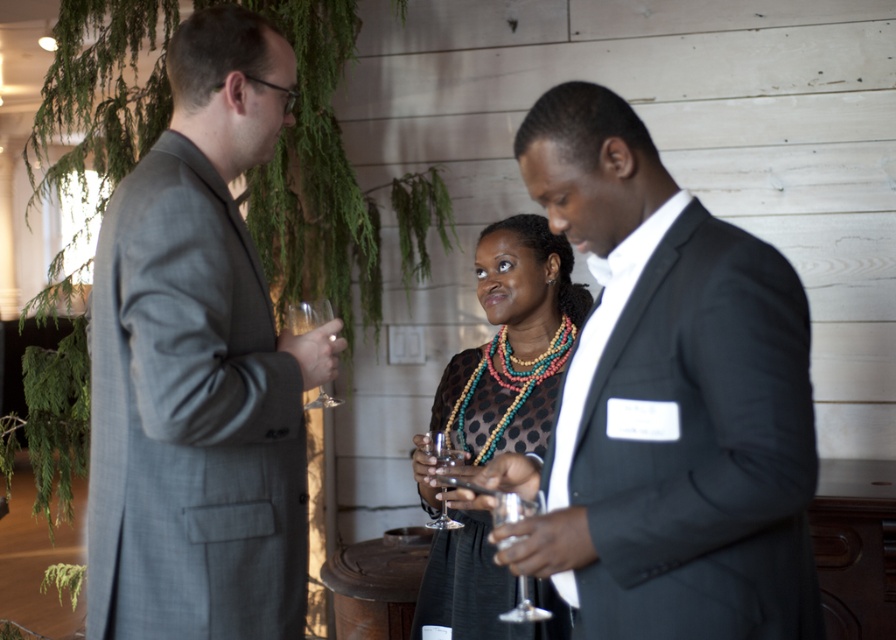
Question: Does clear glass wine glass at lower center lie behind clear glass wine glass at center?

Choices:
 (A) yes
 (B) no

Answer: (B)

Question: Which point is closer to the camera?

Choices:
 (A) (231, 380)
 (B) (477, 374)
 (C) (323, 310)

Answer: (A)

Question: Is black dotted dress at center positioned before clear glass wine glass at lower center?

Choices:
 (A) yes
 (B) no

Answer: (B)

Question: Is matte black suit at center further to the viewer compared to clear glass wine glass at center?

Choices:
 (A) no
 (B) yes

Answer: (A)

Question: Estimate the real-world distances between objects in this image. Which object is farther from the clear glass wine glass at center?

Choices:
 (A) transparent glass at center
 (B) gray suit at left
 (C) clear glass wine glass at lower center

Answer: (C)

Question: Estimate the real-world distances between objects in this image. Which object is closer to the clear glass wine glass at lower center?

Choices:
 (A) clear glass wine glass at center
 (B) matte black suit at center
 (C) gray suit at left
 (D) transparent glass at center

Answer: (B)